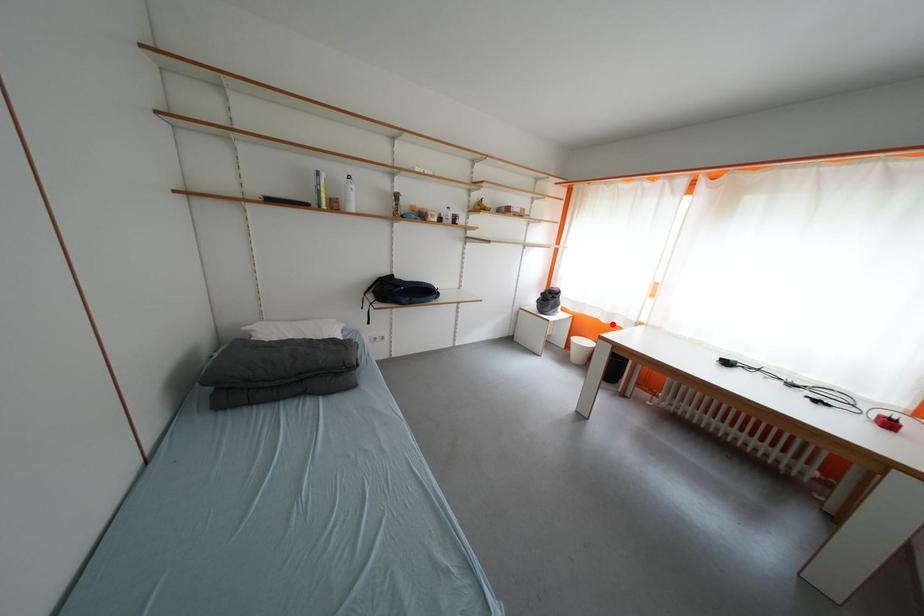
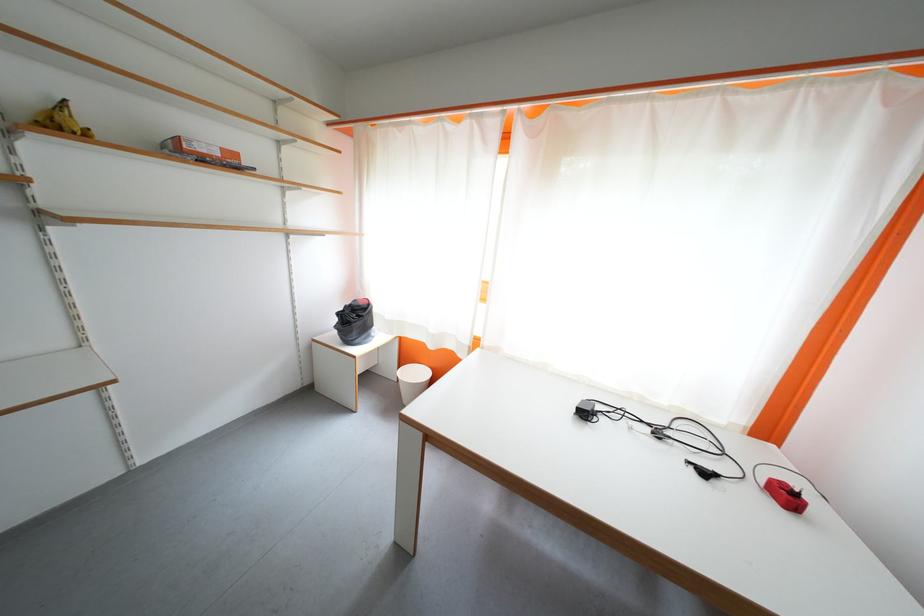
In the second image, find the point that corresponds to the highlighted location in the first image.

(440, 350)